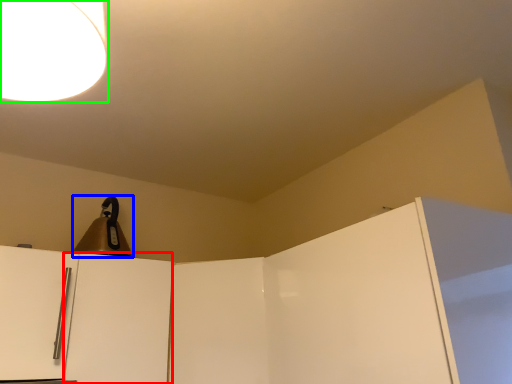
Question: Which is nearer to the door (highlighted by a red box)? appliance (highlighted by a blue box) or lamp (highlighted by a green box).

Choices:
 (A) appliance
 (B) lamp

Answer: (A)